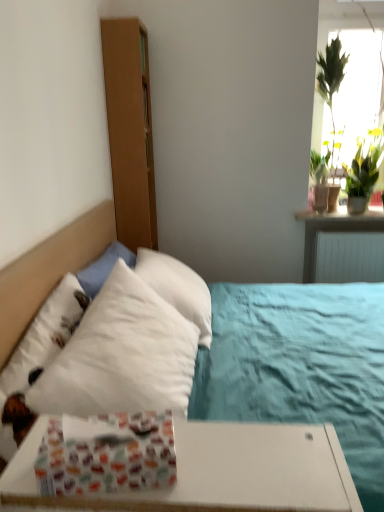
Locate an element on the screen. This screenshot has width=384, height=512. white soft bed at left is located at coordinates (49, 270).

The width and height of the screenshot is (384, 512). Describe the element at coordinates (49, 270) in the screenshot. I see `white soft bed at left` at that location.

I want to click on patterned paper gift wrap at lower left, so click(107, 455).

This screenshot has width=384, height=512. Describe the element at coordinates (107, 455) in the screenshot. I see `patterned paper gift wrap at lower left` at that location.

Locate an element on the screen. white soft bed at left is located at coordinates (49, 270).

Between patterned paper gift wrap at lower left and white soft bed at left, which one appears on the right side from the viewer's perspective?

Positioned to the right is patterned paper gift wrap at lower left.

Consider the image. Which is behind, patterned paper gift wrap at lower left or white soft bed at left?

white soft bed at left is further away from the camera.

Is point (50, 454) closer or farther from the camera than point (282, 441)?

Clearly, point (50, 454) is closer to the camera than point (282, 441).

From the image's perspective, is patterned paper gift wrap at lower left under white soft bed at left?

Yes, from the image's perspective, patterned paper gift wrap at lower left is beneath white soft bed at left.

From a real-world perspective, is patterned paper gift wrap at lower left physically below white soft bed at left?

No, from a real-world perspective, patterned paper gift wrap at lower left is not under white soft bed at left.

Considering the sizes of objects patterned paper gift wrap at lower left and white soft bed at left in the image provided, who is thinner, patterned paper gift wrap at lower left or white soft bed at left?

patterned paper gift wrap at lower left is thinner.

Between patterned paper gift wrap at lower left and white soft bed at left, which one has less height?

With less height is patterned paper gift wrap at lower left.

Considering the sizes of objects patterned paper gift wrap at lower left and white soft bed at left in the image provided, who is bigger, patterned paper gift wrap at lower left or white soft bed at left?

white soft bed at left is bigger.

Is patterned paper gift wrap at lower left spatially inside white soft bed at left, or outside of it?

patterned paper gift wrap at lower left lies outside white soft bed at left.

Is patterned paper gift wrap at lower left not close to white soft bed at left?

Actually, patterned paper gift wrap at lower left and white soft bed at left are a little close together.

Is patterned paper gift wrap at lower left positioned with its back to white soft bed at left?

Yes.

Identify the location of bed behind the patterned paper gift wrap at lower left. The image size is (384, 512). (49, 270).

Is white soft bed at left at the left side of patterned paper gift wrap at lower left?

Indeed, white soft bed at left is positioned on the left side of patterned paper gift wrap at lower left.

Looking at this image, who is more distant, white soft bed at left or patterned paper gift wrap at lower left?

white soft bed at left is further away from the camera.

Considering the positions of points (25, 279) and (164, 472), is point (25, 279) closer to camera compared to point (164, 472)?

No, it is not.

From the image's perspective, which is above, white soft bed at left or patterned paper gift wrap at lower left?

From the image's view, white soft bed at left is above.

From a real-world perspective, is white soft bed at left above or below patterned paper gift wrap at lower left?

white soft bed at left is situated lower than patterned paper gift wrap at lower left in the real world.

Looking at this image, which object is wider, white soft bed at left or patterned paper gift wrap at lower left?

white soft bed at left is wider.

Between white soft bed at left and patterned paper gift wrap at lower left, which one has less height?

patterned paper gift wrap at lower left is shorter.

Can you confirm if white soft bed at left is bigger than patterned paper gift wrap at lower left?

Yes, white soft bed at left is bigger than patterned paper gift wrap at lower left.

Could patterned paper gift wrap at lower left be considered to be inside white soft bed at left?

No.

Is white soft bed at left positioned far away from patterned paper gift wrap at lower left?

No, white soft bed at left is in close proximity to patterned paper gift wrap at lower left.

Is white soft bed at left aimed at patterned paper gift wrap at lower left?

No, white soft bed at left does not turn towards patterned paper gift wrap at lower left.

How many degrees apart are the facing directions of white soft bed at left and patterned paper gift wrap at lower left?

The facing directions of white soft bed at left and patterned paper gift wrap at lower left are 79.5 degrees apart.

Where is `bed above the patterned paper gift wrap at lower left (from the image's perspective)`? Image resolution: width=384 pixels, height=512 pixels. bed above the patterned paper gift wrap at lower left (from the image's perspective) is located at coordinates (49, 270).

Where is `bed directly beneath the patterned paper gift wrap at lower left (from a real-world perspective)`? This screenshot has height=512, width=384. bed directly beneath the patterned paper gift wrap at lower left (from a real-world perspective) is located at coordinates (49, 270).

This screenshot has width=384, height=512. I want to click on gift wrap below the white soft bed at left (from the image's perspective), so click(107, 455).